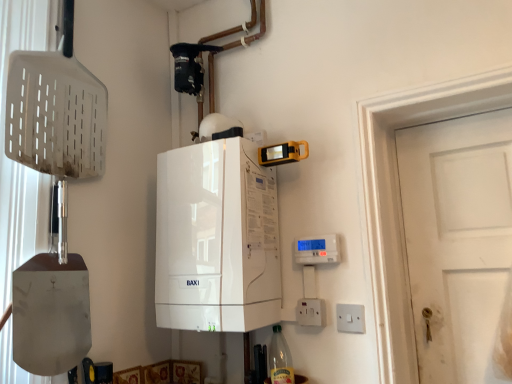
Question: Is white plastic electric outlet at lower right, which is the 1th electric outlet from left to right, taller than white glossy boiler at center?

Choices:
 (A) yes
 (B) no

Answer: (B)

Question: Can you confirm if white plastic electric outlet at lower right, which is the 2th electric outlet from right to left, is thinner than white glossy boiler at center?

Choices:
 (A) no
 (B) yes

Answer: (B)

Question: Does white plastic electric outlet at lower right, which is the 1th electric outlet from left to right, have a smaller size compared to white glossy boiler at center?

Choices:
 (A) no
 (B) yes

Answer: (B)

Question: Is white glossy boiler at center inside white plastic electric outlet at lower right, which is the 2th electric outlet from right to left?

Choices:
 (A) yes
 (B) no

Answer: (B)

Question: Can you see white plastic electric outlet at lower right, which is the 2th electric outlet from right to left, touching white glossy boiler at center?

Choices:
 (A) yes
 (B) no

Answer: (B)

Question: Considering the relative positions of white glossy boiler at center and white plastic switch at lower right, which is the second electric outlet from left to right, in the image provided, is white glossy boiler at center to the left or to the right of white plastic switch at lower right, which is the second electric outlet from left to right,?

Choices:
 (A) right
 (B) left

Answer: (B)

Question: Does point (205, 243) appear closer or farther from the camera than point (352, 326)?

Choices:
 (A) farther
 (B) closer

Answer: (A)

Question: From the image's perspective, is white glossy boiler at center above or below white plastic switch at lower right, placed as the first electric outlet when sorted from right to left?

Choices:
 (A) above
 (B) below

Answer: (A)

Question: In terms of height, does white glossy boiler at center look taller or shorter compared to white plastic switch at lower right, placed as the first electric outlet when sorted from right to left?

Choices:
 (A) tall
 (B) short

Answer: (A)

Question: From a real-world perspective, relative to white glossy boiler at center, is clear glass bottle at lower center vertically above or below?

Choices:
 (A) above
 (B) below

Answer: (B)

Question: In terms of height, does clear glass bottle at lower center look taller or shorter compared to white glossy boiler at center?

Choices:
 (A) tall
 (B) short

Answer: (B)

Question: From the image's perspective, relative to white glossy boiler at center, is clear glass bottle at lower center above or below?

Choices:
 (A) above
 (B) below

Answer: (B)

Question: Considering the positions of clear glass bottle at lower center and white glossy boiler at center in the image, is clear glass bottle at lower center bigger or smaller than white glossy boiler at center?

Choices:
 (A) small
 (B) big

Answer: (A)

Question: Is clear glass bottle at lower center wider or thinner than white plastic switch at lower right, which is the second electric outlet from left to right?

Choices:
 (A) thin
 (B) wide

Answer: (B)

Question: Is clear glass bottle at lower center inside the boundaries of white plastic switch at lower right, placed as the first electric outlet when sorted from right to left, or outside?

Choices:
 (A) outside
 (B) inside

Answer: (A)